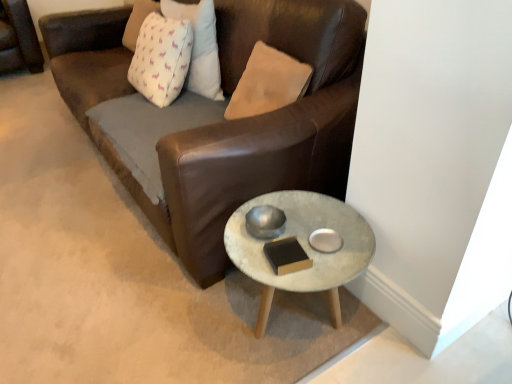
Question: From a real-world perspective, is marble-coated coffee table at lower right physically above white fabric pillow at upper left?

Choices:
 (A) yes
 (B) no

Answer: (B)

Question: From the image's perspective, is marble-coated coffee table at lower right on white fabric pillow at upper left?

Choices:
 (A) yes
 (B) no

Answer: (B)

Question: Does marble-coated coffee table at lower right appear on the left side of white fabric pillow at upper left?

Choices:
 (A) no
 (B) yes

Answer: (A)

Question: Does marble-coated coffee table at lower right come behind white fabric pillow at upper left?

Choices:
 (A) yes
 (B) no

Answer: (B)

Question: From the image's perspective, would you say marble-coated coffee table at lower right is shown under white fabric pillow at upper left?

Choices:
 (A) no
 (B) yes

Answer: (B)

Question: Is the position of marble-coated coffee table at lower right less distant than that of white fabric pillow at upper left?

Choices:
 (A) yes
 (B) no

Answer: (A)

Question: From the image's perspective, is white fabric pillow at upper left beneath marble-coated coffee table at lower right?

Choices:
 (A) no
 (B) yes

Answer: (A)

Question: Is white fabric pillow at upper left not close to marble-coated coffee table at lower right?

Choices:
 (A) yes
 (B) no

Answer: (B)

Question: Is white fabric pillow at upper left positioned beyond the bounds of marble-coated coffee table at lower right?

Choices:
 (A) yes
 (B) no

Answer: (A)

Question: Is the surface of white fabric pillow at upper left in direct contact with marble-coated coffee table at lower right?

Choices:
 (A) yes
 (B) no

Answer: (B)

Question: From a real-world perspective, is white fabric pillow at upper left on top of marble-coated coffee table at lower right?

Choices:
 (A) no
 (B) yes

Answer: (B)

Question: Can you confirm if white fabric pillow at upper left is smaller than marble-coated coffee table at lower right?

Choices:
 (A) yes
 (B) no

Answer: (A)

Question: Considering the relative positions of white fabric pillow at upper left and marble-coated coffee table at lower right in the image provided, is white fabric pillow at upper left to the left or to the right of marble-coated coffee table at lower right?

Choices:
 (A) right
 (B) left

Answer: (B)